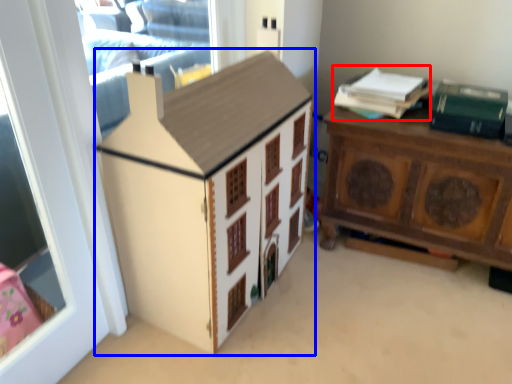
Question: Which object is further to the camera taking this photo, book (highlighted by a red box) or cabinetry (highlighted by a blue box)?

Choices:
 (A) book
 (B) cabinetry

Answer: (A)